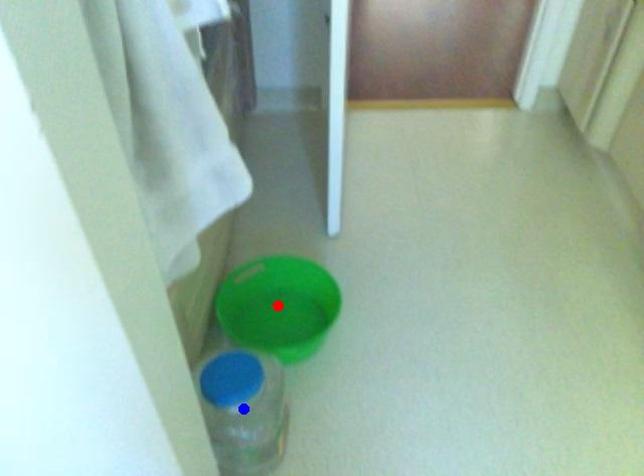
Question: In the image, two points are highlighted. Which point is nearer to the camera? Reply with the corresponding letter.

Choices:
 (A) blue point
 (B) red point

Answer: (A)